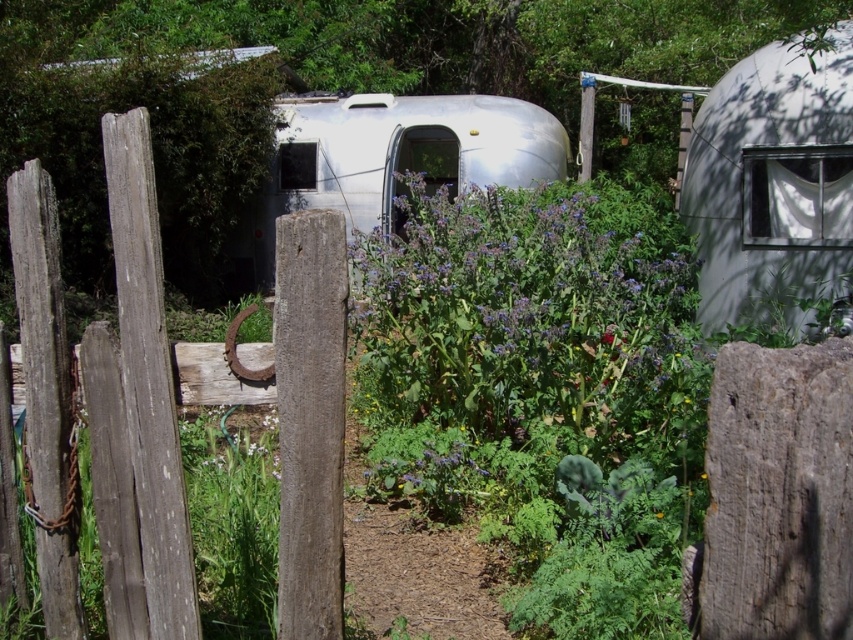
Does weathered wood fence at left have a lesser height compared to silver metallic trailer at center?

Yes, weathered wood fence at left is shorter than silver metallic trailer at center.

Does weathered wood fence at left appear on the right side of silver metallic trailer at center?

Incorrect, weathered wood fence at left is not on the right side of silver metallic trailer at center.

Who is more distant from viewer, (190, 349) or (346, 173)?

The point (346, 173) is more distant.

What are the coordinates of `weathered wood fence at left` in the screenshot? It's located at (213, 403).